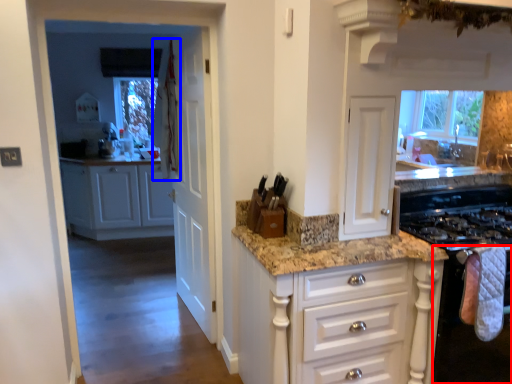
Question: Which of the following is the closest to the observer, oven (highlighted by a red box) or curtain (highlighted by a blue box)?

Choices:
 (A) oven
 (B) curtain

Answer: (A)